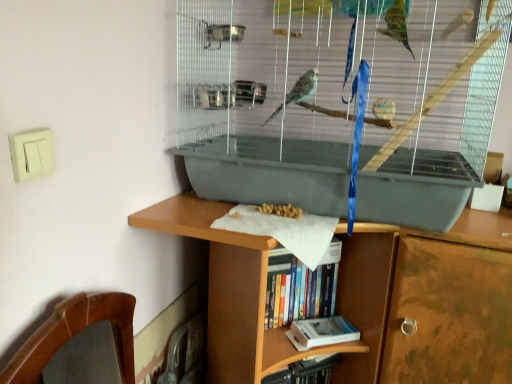
Question: Is hardcover book at lower center, positioned as the 2th book in top-to-bottom order, bigger or smaller than gray plastic birdcage at center?

Choices:
 (A) big
 (B) small

Answer: (B)

Question: From their relative heights in the image, would you say hardcover book at lower center, positioned as the 2th book in top-to-bottom order, is taller or shorter than gray plastic birdcage at center?

Choices:
 (A) short
 (B) tall

Answer: (A)

Question: Estimate the real-world distances between objects in this image. Which object is farther from the hardcover book at lower center, the first book when ordered from bottom to top?

Choices:
 (A) hardcover book at center, the second book positioned from the bottom
 (B) gray plastic birdcage at center

Answer: (B)

Question: Based on their relative distances, which object is farther from the hardcover book at lower center, the first book when ordered from bottom to top?

Choices:
 (A) hardcover book at center, which is counted as the 1th book, starting from the top
 (B) gray plastic birdcage at center

Answer: (B)